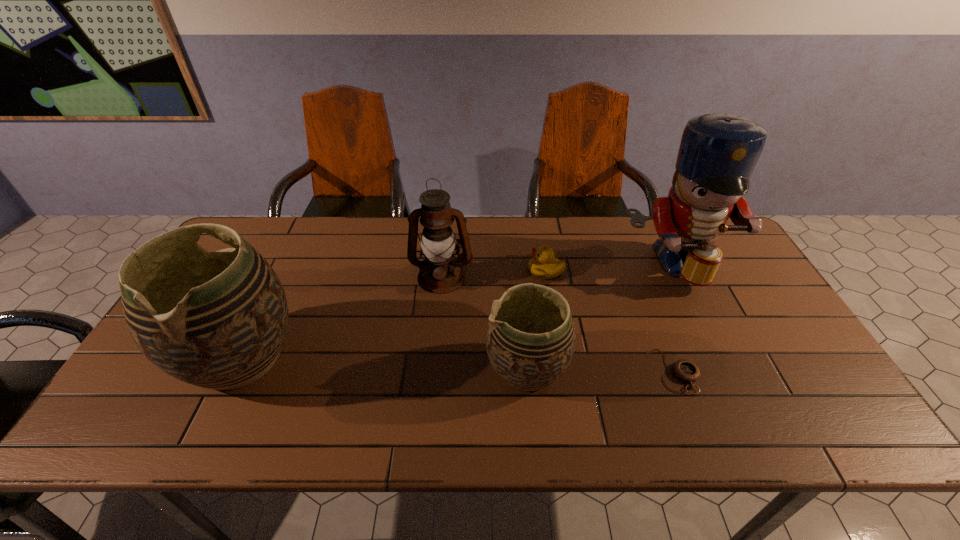
Please point a spot to add another pottery on the right. Please provide its 2D coordinates. Your answer should be formatted as a tuple, i.e. [(x, y)], where the tuple contains the x and y coordinates of a point satisfying the conditions above.

[(827, 382)]